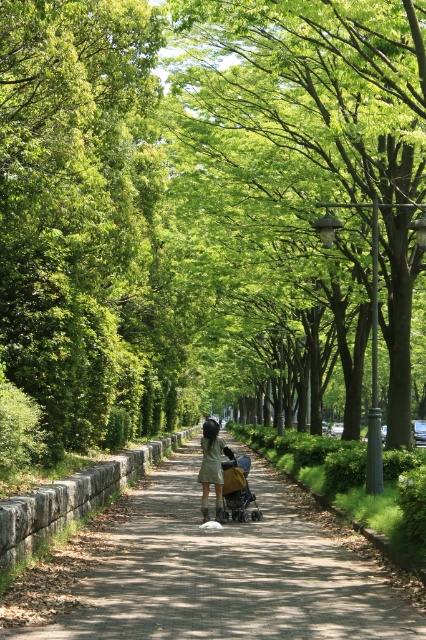
You are a park visitor walking along the pathway and see both the matte gray dress at center and the brown fabric baby carriage at center. Which object is positioned to the left of the other?

The matte gray dress at center is to the left of the brown fabric baby carriage at center.

You are a park visitor carrying a 24 inch wide backpack. You want to walk through the pathway while avoiding the matte gray dress at center and the brown fabric baby carriage at center. Can you pass between them without touching either?

The matte gray dress at center and brown fabric baby carriage at center are 30.62 inches apart. Since your backpack is 24 inches wide, you can pass between them safely as the space is wider than your backpack.